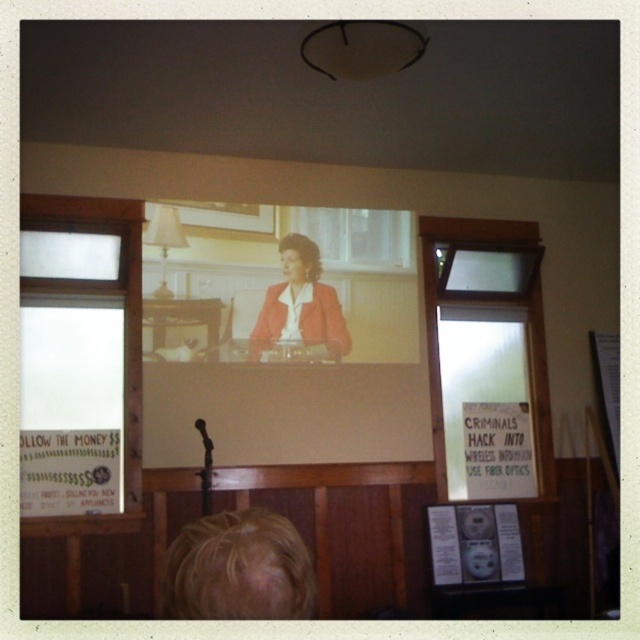
Question: Does blonde hair at lower left have a smaller size compared to matte red blazer at center?

Choices:
 (A) yes
 (B) no

Answer: (A)

Question: Is blonde hair at lower left in front of matte red blazer at center?

Choices:
 (A) yes
 (B) no

Answer: (A)

Question: Among these objects, which one is farthest from the camera?

Choices:
 (A) matte red blazer at center
 (B) blonde hair at lower left

Answer: (A)

Question: Does blonde hair at lower left come in front of matte red blazer at center?

Choices:
 (A) yes
 (B) no

Answer: (A)